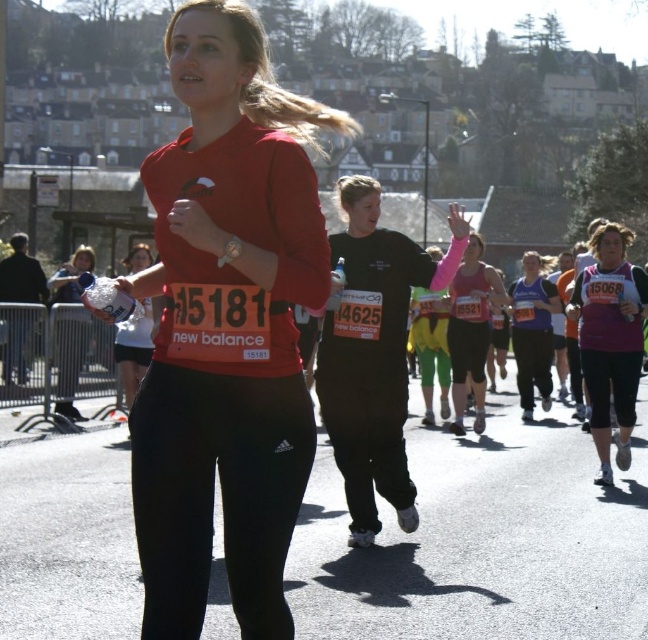
Looking at this image, you are a photographer at the marathon event. You want to capture a photo of the purple matte tank top at center and the pink matte tank top at center. Which one should you zoom in on first if you want to focus on the larger clothing item?

The pink matte tank top at center is larger, so you should zoom in on the pink matte tank top at center first to focus on the larger clothing item.

You are a photographer at the marathon event. You want to take a photo of the runner wearing the pink matte tank top at center and the matte black leggings at center. Based on their positions, which clothing item will be more visible in the photo?

The pink matte tank top at center is below matte black leggings at center, so the matte black leggings at center will be more visible in the photo as it is positioned higher up.